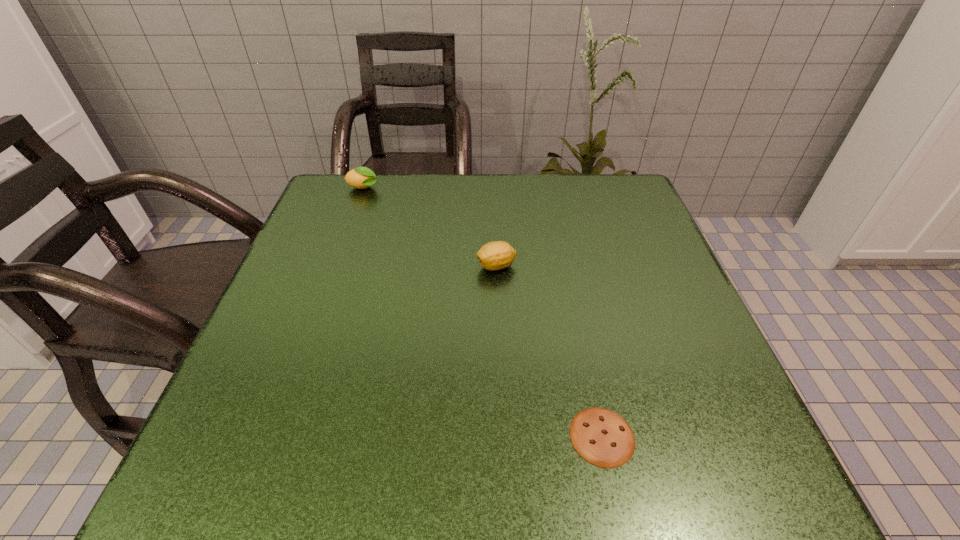
I want to click on the farther lemon, so click(x=362, y=177).

The image size is (960, 540). I want to click on the left lemon, so click(362, 177).

This screenshot has height=540, width=960. Find the location of `the nearer lemon`. the nearer lemon is located at coordinates (496, 255).

This screenshot has width=960, height=540. What are the coordinates of `the right lemon` in the screenshot? It's located at (496, 255).

Where is `the shortest object`? The height and width of the screenshot is (540, 960). the shortest object is located at coordinates (602, 437).

Locate an element on the screen. This screenshot has height=540, width=960. the nearest object is located at coordinates (602, 437).

Locate an element on the screen. This screenshot has width=960, height=540. vacant position located 0.270m with leaves positioned above the leftmost object is located at coordinates (484, 188).

Image resolution: width=960 pixels, height=540 pixels. Find the location of `free location located at the stem end of the second farthest object`. free location located at the stem end of the second farthest object is located at coordinates (329, 266).

The image size is (960, 540). What are the coordinates of `free space located 0.070m at the stem end of the second farthest object` in the screenshot? It's located at (444, 266).

Locate an element on the screen. The image size is (960, 540). free region located at the stem end of the second farthest object is located at coordinates (368, 266).